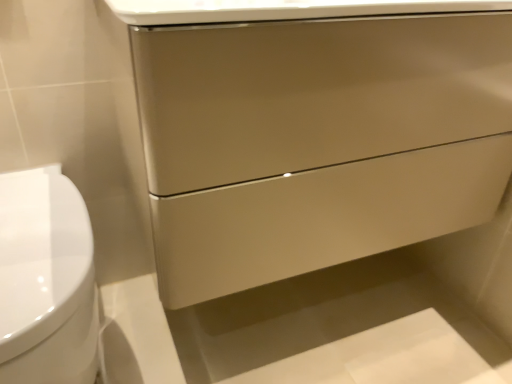
Question: In terms of width, does matte beige drawer at center look wider or thinner when compared to white glossy toilet at left?

Choices:
 (A) thin
 (B) wide

Answer: (A)

Question: From their relative heights in the image, would you say matte beige drawer at center is taller or shorter than white glossy toilet at left?

Choices:
 (A) short
 (B) tall

Answer: (A)

Question: From a real-world perspective, is matte beige drawer at center positioned above or below white glossy toilet at left?

Choices:
 (A) above
 (B) below

Answer: (A)

Question: Is white glossy toilet at left taller or shorter than matte beige drawer at center?

Choices:
 (A) short
 (B) tall

Answer: (B)

Question: Based on their positions, is white glossy toilet at left located to the left or right of matte beige drawer at center?

Choices:
 (A) right
 (B) left

Answer: (B)

Question: Is white glossy toilet at left inside or outside of matte beige drawer at center?

Choices:
 (A) inside
 (B) outside

Answer: (B)

Question: Considering their positions, is white glossy toilet at left located in front of or behind matte beige drawer at center?

Choices:
 (A) front
 (B) behind

Answer: (A)